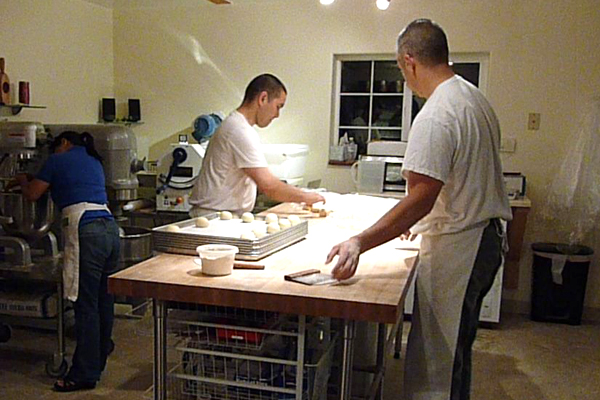
Locate an element on the screen. This screenshot has width=600, height=400. table is located at coordinates (260, 288).